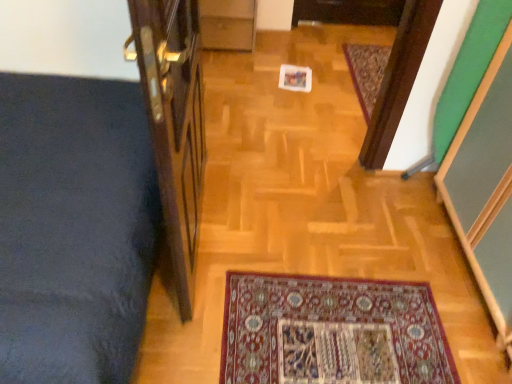
What are the coordinates of `unoccupied area in front of wooden door at left` in the screenshot? It's located at (x=218, y=324).